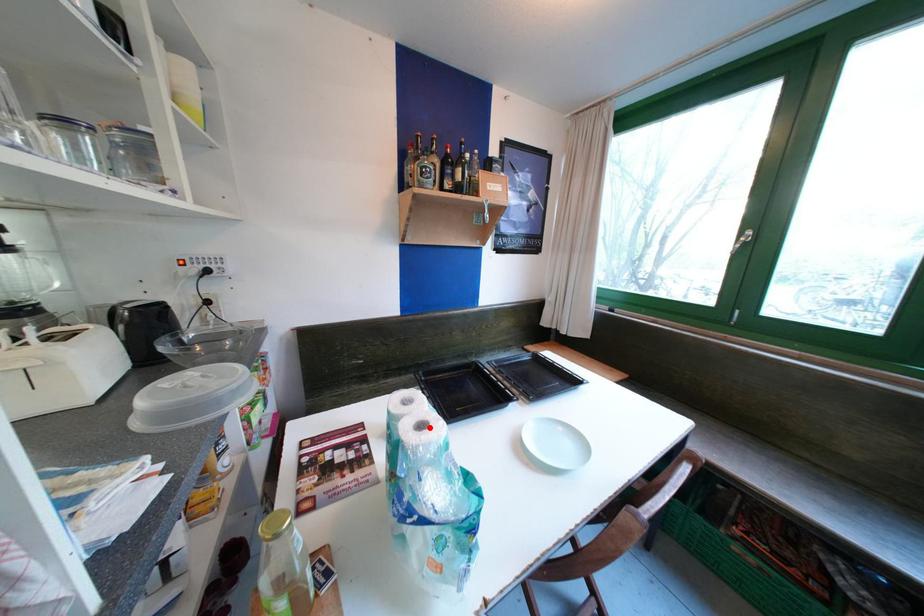
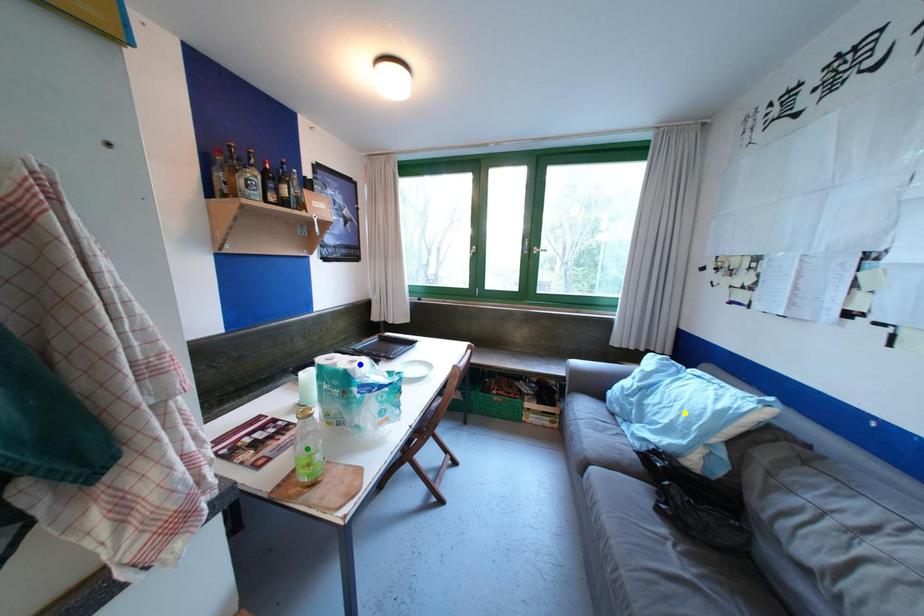
Question: I am providing you with two images of the same scene from different viewpoints. A red point is marked on the first image. You are given multiple points on the second image. Which mark in image 2 goes with the point in image 1?

Choices:
 (A) yellow point
 (B) blue point
 (C) green point

Answer: (B)